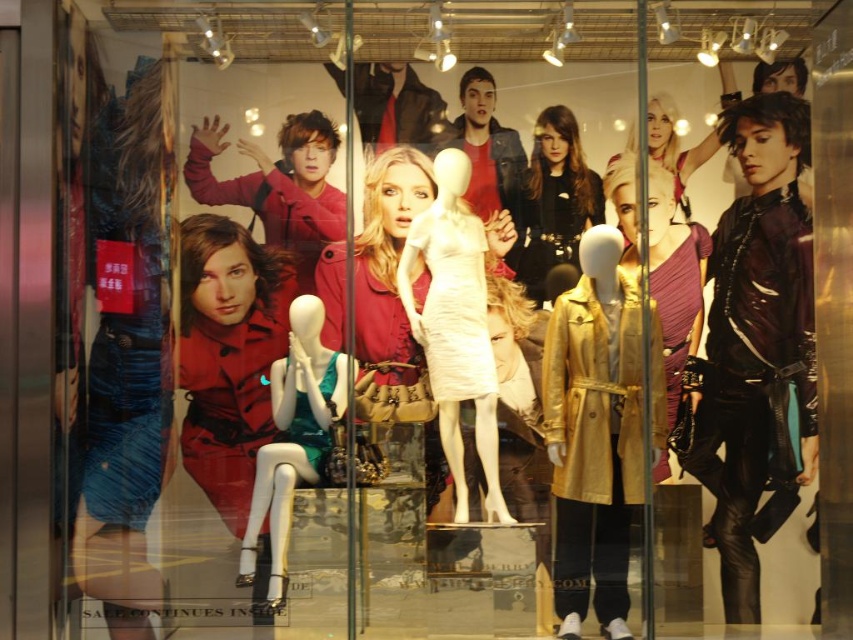
Question: Which point is farther from the camera taking this photo?

Choices:
 (A) (540, 196)
 (B) (494, 467)

Answer: (A)

Question: Is shiny black leather jacket at right thinner than matte black dress at center?

Choices:
 (A) no
 (B) yes

Answer: (A)

Question: Does shiny black leather jacket at right come behind metallic gold coat at center?

Choices:
 (A) yes
 (B) no

Answer: (A)

Question: Is shiny black leather jacket at right above green shiny dress at center?

Choices:
 (A) no
 (B) yes

Answer: (B)

Question: Which point is farther to the camera?

Choices:
 (A) shiny black leather jacket at right
 (B) matte black dress at center

Answer: (A)

Question: Which object appears farthest from the camera in this image?

Choices:
 (A) matte gold coat at upper right
 (B) shiny black leather jacket at right
 (C) green shiny dress at center
 (D) white matte dress at center

Answer: (A)